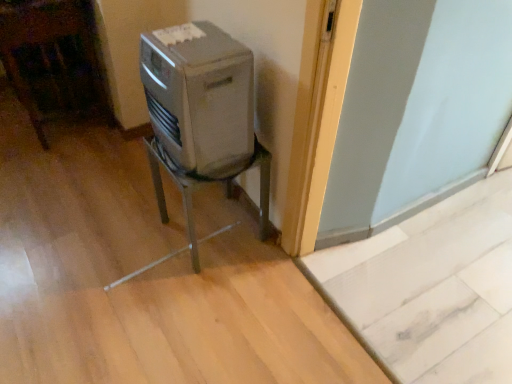
In order to face satin silver appliance at center, should I rotate leftwards or rightwards?

Rotate your view left by about 8.127°.

The height and width of the screenshot is (384, 512). In order to click on satin silver appliance at center in this screenshot , I will do `click(200, 98)`.

What is the approximate width of satin silver appliance at center?

The width of satin silver appliance at center is 26.39 centimeters.

The height and width of the screenshot is (384, 512). What do you see at coordinates (200, 98) in the screenshot?
I see `satin silver appliance at center` at bounding box center [200, 98].

Locate an element on the screen. This screenshot has width=512, height=384. metallic gray air conditioner at center is located at coordinates (183, 204).

This screenshot has height=384, width=512. Describe the element at coordinates (183, 204) in the screenshot. I see `metallic gray air conditioner at center` at that location.

You are a GUI agent. You are given a task and a screenshot of the screen. Output one action in this format:
    pyautogui.click(x=<x>, y=<y>)
    Task: Click on the satin silver appliance at center
    The image size is (512, 384).
    Given the screenshot: What is the action you would take?
    pyautogui.click(x=200, y=98)

Is satin silver appliance at center to the left of metallic gray air conditioner at center from the viewer's perspective?

Correct, you'll find satin silver appliance at center to the left of metallic gray air conditioner at center.

Considering their positions, is satin silver appliance at center located in front of or behind metallic gray air conditioner at center?

Clearly, satin silver appliance at center is in front of metallic gray air conditioner at center.

Does point (228, 53) come in front of point (179, 251)?

That is True.

From the image's perspective, is satin silver appliance at center over metallic gray air conditioner at center?

Yes, from the image's perspective, satin silver appliance at center is over metallic gray air conditioner at center.

From a real-world perspective, between satin silver appliance at center and metallic gray air conditioner at center, who is vertically higher?

From a 3D spatial view, satin silver appliance at center is above.

Can you confirm if satin silver appliance at center is thinner than metallic gray air conditioner at center?

Indeed, satin silver appliance at center has a lesser width compared to metallic gray air conditioner at center.

Does satin silver appliance at center have a lesser height compared to metallic gray air conditioner at center?

Indeed, satin silver appliance at center has a lesser height compared to metallic gray air conditioner at center.

Who is smaller, satin silver appliance at center or metallic gray air conditioner at center?

With smaller size is satin silver appliance at center.

Is satin silver appliance at center positioned beyond the bounds of metallic gray air conditioner at center?

That's correct, satin silver appliance at center is outside of metallic gray air conditioner at center.

Does satin silver appliance at center touch metallic gray air conditioner at center?

There is a gap between satin silver appliance at center and metallic gray air conditioner at center.

Is satin silver appliance at center turned away from metallic gray air conditioner at center?

No, satin silver appliance at center is not facing away from metallic gray air conditioner at center.

Consider the image. How distant is satin silver appliance at center from metallic gray air conditioner at center?

satin silver appliance at center and metallic gray air conditioner at center are 21.50 centimeters apart.

Identify the location of home appliance in front of the metallic gray air conditioner at center. (200, 98).

Which is more to the right, metallic gray air conditioner at center or satin silver appliance at center?

Positioned to the right is metallic gray air conditioner at center.

Which object is closer to the camera taking this photo, metallic gray air conditioner at center or satin silver appliance at center?

Positioned in front is satin silver appliance at center.

Considering the positions of points (151, 172) and (172, 38), is point (151, 172) closer to camera compared to point (172, 38)?

No, (151, 172) is behind (172, 38).

From the image's perspective, who appears lower, metallic gray air conditioner at center or satin silver appliance at center?

metallic gray air conditioner at center appears lower in the image.

From a real-world perspective, relative to satin silver appliance at center, is metallic gray air conditioner at center vertically above or below?

metallic gray air conditioner at center is below satin silver appliance at center.

Based on the photo, in terms of width, does metallic gray air conditioner at center look wider or thinner when compared to satin silver appliance at center?

Considering their sizes, metallic gray air conditioner at center looks broader than satin silver appliance at center.

Who is shorter, metallic gray air conditioner at center or satin silver appliance at center?

Standing shorter between the two is satin silver appliance at center.

Looking at the image, does metallic gray air conditioner at center seem bigger or smaller compared to satin silver appliance at center?

metallic gray air conditioner at center is bigger than satin silver appliance at center.

In the scene shown: Is metallic gray air conditioner at center located outside satin silver appliance at center?

A: metallic gray air conditioner at center is positioned outside satin silver appliance at center.

Are metallic gray air conditioner at center and satin silver appliance at center located far from each other?

No.

Does metallic gray air conditioner at center turn towards satin silver appliance at center?

No.

The image size is (512, 384). I want to click on home appliance that appears above the metallic gray air conditioner at center (from the image's perspective), so click(200, 98).

Where is `home appliance that appears on the left of metallic gray air conditioner at center`? This screenshot has height=384, width=512. home appliance that appears on the left of metallic gray air conditioner at center is located at coordinates (200, 98).

Where is `home appliance located above the metallic gray air conditioner at center (from the image's perspective)`? This screenshot has width=512, height=384. home appliance located above the metallic gray air conditioner at center (from the image's perspective) is located at coordinates (200, 98).